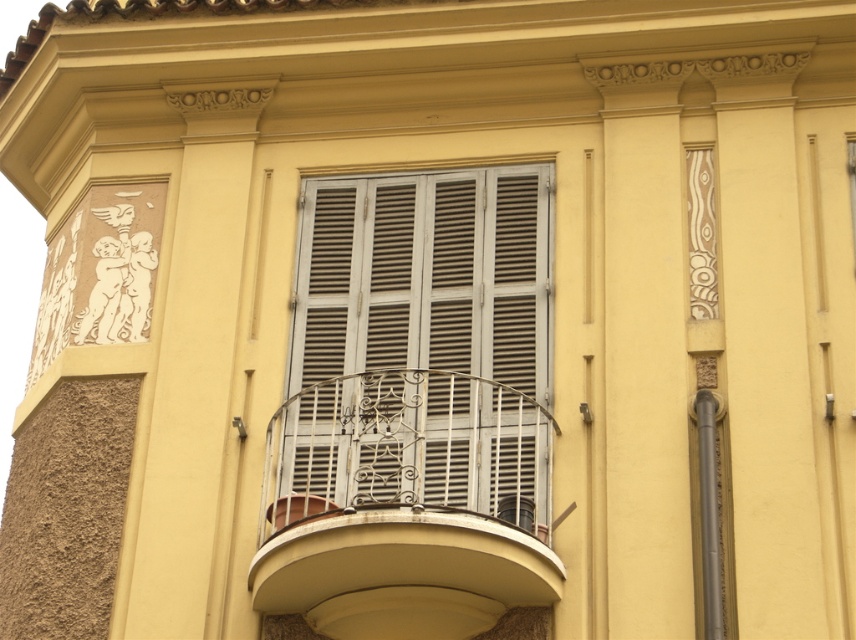
Question: From the image, what is the correct spatial relationship of white matte shutters at center in relation to white metal balcony at center?

Choices:
 (A) left
 (B) right

Answer: (B)

Question: Is white matte shutters at center to the right of white metal balcony at center from the viewer's perspective?

Choices:
 (A) no
 (B) yes

Answer: (B)

Question: Which of the following is the closest to the observer?

Choices:
 (A) (444, 216)
 (B) (275, 544)

Answer: (B)

Question: Is white matte shutters at center to the right of white metal balcony at center from the viewer's perspective?

Choices:
 (A) no
 (B) yes

Answer: (B)